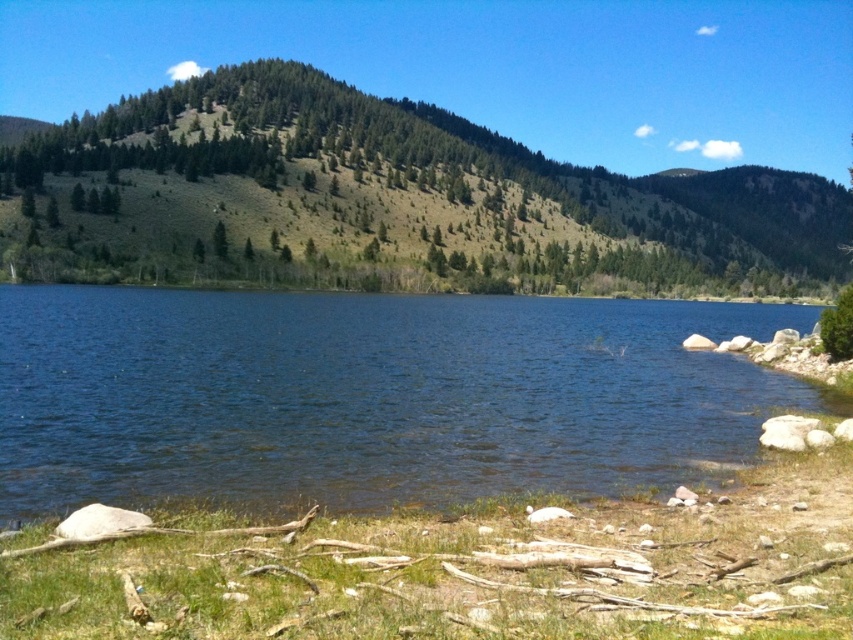
Which is below, blue water at center or green textured hillside at center?

blue water at center is below.

You are a GUI agent. You are given a task and a screenshot of the screen. Output one action in this format:
    pyautogui.click(x=<x>, y=<y>)
    Task: Click on the blue water at center
    
    Given the screenshot: What is the action you would take?
    pyautogui.click(x=369, y=396)